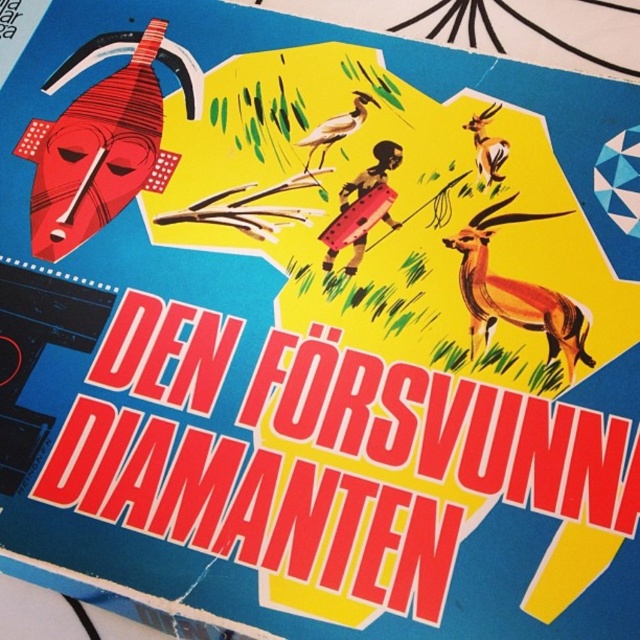
Between matte red mask at upper left and orange glossy antelope at center, which one has more height?

matte red mask at upper left is taller.

Is matte red mask at upper left thinner than orange glossy antelope at center?

In fact, matte red mask at upper left might be wider than orange glossy antelope at center.

Image resolution: width=640 pixels, height=640 pixels. Find the location of `matte red mask at upper left`. matte red mask at upper left is located at coordinates (104, 140).

Locate an element on the screen. This screenshot has width=640, height=640. matte red mask at upper left is located at coordinates (104, 140).

Is matte red mask at upper left smaller than orange glossy antelope at upper right?

No, matte red mask at upper left is not smaller than orange glossy antelope at upper right.

Who is positioned more to the right, matte red mask at upper left or orange glossy antelope at upper right?

From the viewer's perspective, orange glossy antelope at upper right appears more on the right side.

Between point (156, 116) and point (477, 124), which one is positioned behind?

The point (156, 116) is behind.

This screenshot has height=640, width=640. I want to click on matte red mask at upper left, so click(x=104, y=140).

Based on the photo, can you confirm if orange glossy antelope at center is wider than brown matte bird at center?

Yes, orange glossy antelope at center is wider than brown matte bird at center.

Can you confirm if orange glossy antelope at center is positioned to the right of brown matte bird at center?

Yes, orange glossy antelope at center is to the right of brown matte bird at center.

Who is more forward, (513, 314) or (376, 100)?

Positioned in front is point (513, 314).

Where is `orange glossy antelope at center`? Image resolution: width=640 pixels, height=640 pixels. orange glossy antelope at center is located at coordinates (515, 292).